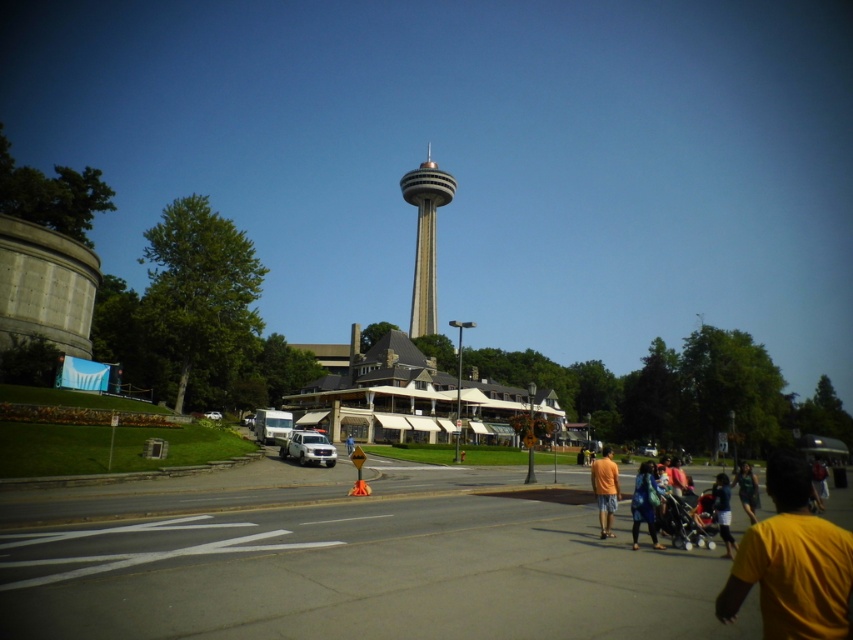
You are a tourist standing at the pedestrian crossing on the wide road. You want to take a photo of the gray concrete tower at center and the dark blue fabric at lower right in the same frame. Which object should you focus on first to ensure both are in the shot?

You should focus on the gray concrete tower at center first because it is larger in size than the dark blue fabric at lower right, so it will occupy more space in the frame and ensure both are included.

You are a photographer standing at the base of the Skylon Tower and notice two shirts hanging on a rack near the road. The shirts are the yellow matte shirt at lower right and the green fabric shirt at lower right. Which shirt is closer to you?

The yellow matte shirt at lower right is closer to you because it is in front of the green fabric shirt at lower right.